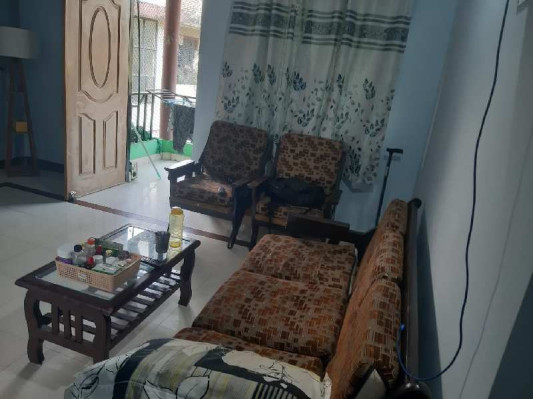
In order to click on sofa cushions in this screenshot , I will do `click(305, 258)`, `click(370, 254)`, `click(389, 324)`, `click(298, 317)`, `click(304, 358)`.